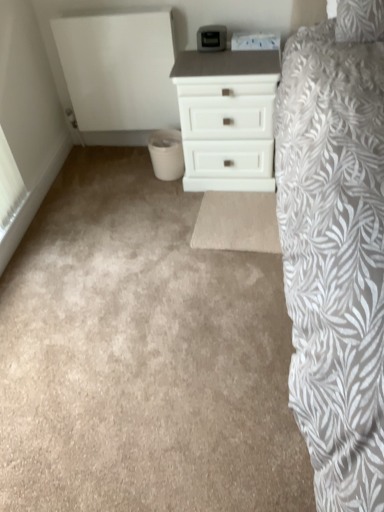
Question: From a real-world perspective, relative to white matte chest of drawers at center, is beige carpet at center vertically above or below?

Choices:
 (A) below
 (B) above

Answer: (A)

Question: In the image, is beige carpet at center on the left side or the right side of white matte chest of drawers at center?

Choices:
 (A) left
 (B) right

Answer: (A)

Question: Is beige carpet at center wider or thinner than white matte chest of drawers at center?

Choices:
 (A) wide
 (B) thin

Answer: (A)

Question: Considering the positions of point (236, 61) and point (206, 436), is point (236, 61) closer or farther from the camera than point (206, 436)?

Choices:
 (A) farther
 (B) closer

Answer: (A)

Question: In the image, is white matte chest of drawers at center positioned in front of or behind beige carpet at center?

Choices:
 (A) front
 (B) behind

Answer: (B)

Question: Looking at the image, does white matte chest of drawers at center seem bigger or smaller compared to beige carpet at center?

Choices:
 (A) big
 (B) small

Answer: (B)

Question: Is white matte chest of drawers at center spatially inside beige carpet at center, or outside of it?

Choices:
 (A) inside
 (B) outside

Answer: (B)